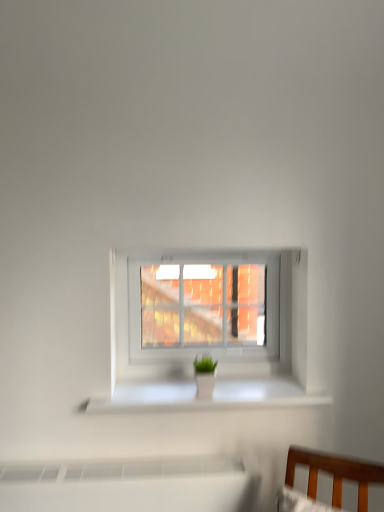
The width and height of the screenshot is (384, 512). What do you see at coordinates (210, 314) in the screenshot?
I see `white plastic window at center` at bounding box center [210, 314].

I want to click on white plastic window at center, so click(210, 314).

Measure the distance between white plastic window at center and camera.

The depth of white plastic window at center is 1.33 meters.

In order to face white plastic window at center, should I rotate leftwards or rightwards?

Rotate your view right by about 2.195°.

Identify the location of white glossy planter at center. (206, 399).

What is the approximate width of white glossy planter at center?

It is 9.44 inches.

Image resolution: width=384 pixels, height=512 pixels. What do you see at coordinates (206, 399) in the screenshot?
I see `white glossy planter at center` at bounding box center [206, 399].

This screenshot has width=384, height=512. In order to click on white plastic window at center in this screenshot , I will do `click(210, 314)`.

Between white glossy planter at center and white plastic window at center, which one appears on the right side from the viewer's perspective?

From the viewer's perspective, white plastic window at center appears more on the right side.

Is the position of white glossy planter at center more distant than that of white plastic window at center?

No, white glossy planter at center is closer to the viewer.

Does point (210, 405) come behind point (304, 324)?

No.

From the image's perspective, is white glossy planter at center above or below white plastic window at center?

white glossy planter at center is below white plastic window at center.

From a real-world perspective, is white glossy planter at center over white plastic window at center?

No, from a real-world perspective, white glossy planter at center is not on top of white plastic window at center.

Can you confirm if white glossy planter at center is wider than white plastic window at center?

Indeed, white glossy planter at center has a greater width compared to white plastic window at center.

Considering the sizes of white glossy planter at center and white plastic window at center in the image, is white glossy planter at center taller or shorter than white plastic window at center?

Clearly, white glossy planter at center is shorter compared to white plastic window at center.

Considering the sizes of objects white glossy planter at center and white plastic window at center in the image provided, who is bigger, white glossy planter at center or white plastic window at center?

white plastic window at center.

Choose the correct answer: Is white glossy planter at center inside white plastic window at center or outside it?

white glossy planter at center exists outside the volume of white plastic window at center.

In the scene shown: Is white glossy planter at center far from white plastic window at center?

white glossy planter at center is near white plastic window at center, not far away.

Is white glossy planter at center facing towards white plastic window at center?

No, white glossy planter at center does not turn towards white plastic window at center.

How many degrees apart are the facing directions of white glossy planter at center and white plastic window at center?

They differ by 0.000236 degrees in their facing directions.

Identify the location of window located above the white glossy planter at center (from the image's perspective). (210, 314).

Is white plastic window at center to the right of white glossy planter at center from the viewer's perspective?

Yes, white plastic window at center is to the right of white glossy planter at center.

Is the depth of white plastic window at center less than that of white glossy planter at center?

No, it is behind white glossy planter at center.

Which point is more distant from viewer, (188, 368) or (116, 395)?

The point (188, 368) is farther.

From the image's perspective, which object appears higher, white plastic window at center or white glossy planter at center?

white plastic window at center appears higher in the image.

From a real-world perspective, is white plastic window at center located beneath white glossy planter at center?

No, from a real-world perspective, white plastic window at center is not beneath white glossy planter at center.

Which object is thinner, white plastic window at center or white glossy planter at center?

Thinner between the two is white plastic window at center.

Can you confirm if white plastic window at center is taller than white glossy planter at center?

Yes, white plastic window at center is taller than white glossy planter at center.

Which of these two, white plastic window at center or white glossy planter at center, is bigger?

With larger size is white plastic window at center.

Choose the correct answer: Is white plastic window at center inside white glossy planter at center or outside it?

white plastic window at center is spatially situated outside white glossy planter at center.

Is white plastic window at center not close to white glossy planter at center?

No, white plastic window at center is not far away from white glossy planter at center.

Is white glossy planter at center at the back of white plastic window at center?

No, white plastic window at center's orientation is not away from white glossy planter at center.

Can you tell me how much white plastic window at center and white glossy planter at center differ in facing direction?

They differ by 0.000236 degrees in their facing directions.

How much distance is there between white plastic window at center and white glossy planter at center?

white plastic window at center is 19.78 centimeters away from white glossy planter at center.

You are a GUI agent. You are given a task and a screenshot of the screen. Output one action in this format:
    pyautogui.click(x=<x>, y=<y>)
    Task: Click on the window sill on the left of white plastic window at center
    The height and width of the screenshot is (512, 384).
    Given the screenshot: What is the action you would take?
    pyautogui.click(x=206, y=399)

Locate an element on the screen. window lying above the white glossy planter at center (from the image's perspective) is located at coordinates (210, 314).

Where is `window sill below the white plastic window at center (from the image's perspective)`? Image resolution: width=384 pixels, height=512 pixels. window sill below the white plastic window at center (from the image's perspective) is located at coordinates (206, 399).